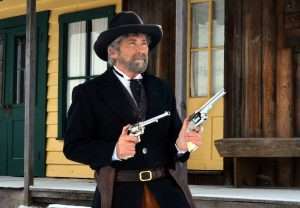
Where is `bench`? The width and height of the screenshot is (300, 208). bench is located at coordinates (249, 150).